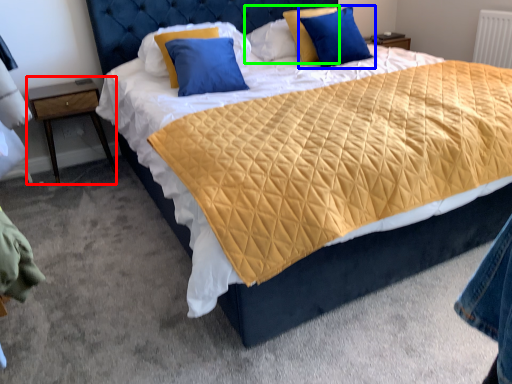
Question: Considering the real-world distances, which object is farthest from nightstand (highlighted by a red box)? pillow (highlighted by a blue box) or pillow (highlighted by a green box)?

Choices:
 (A) pillow
 (B) pillow

Answer: (A)